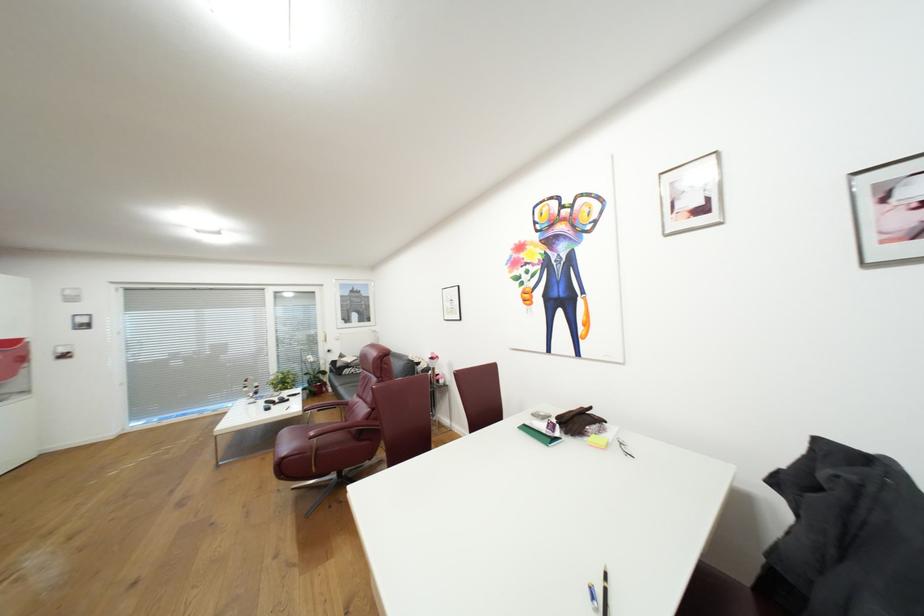
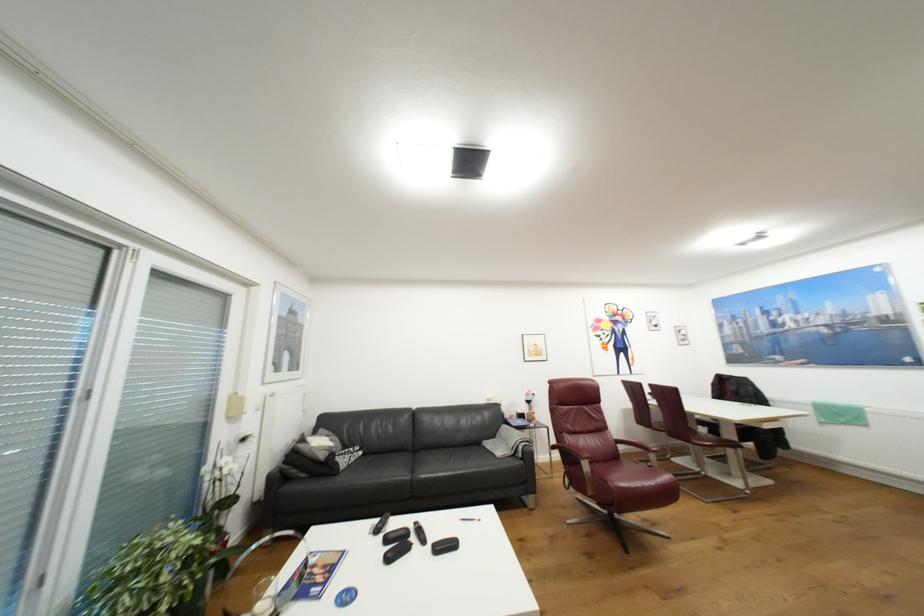
The point at (348, 355) is marked in the first image. Where is the corresponding point in the second image?

(309, 440)